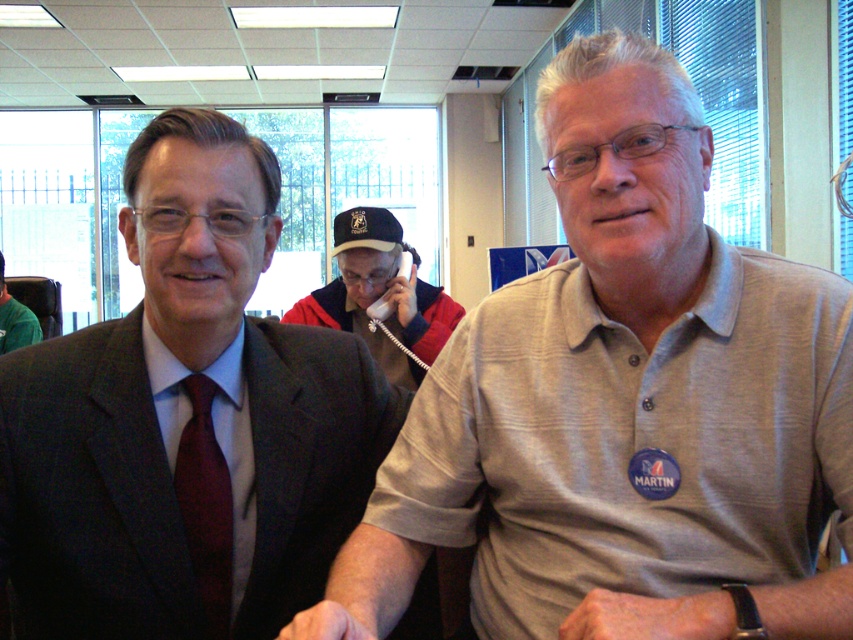
Question: In this image, where is gray textured polo shirt at center located relative to red jacket at center?

Choices:
 (A) below
 (B) above

Answer: (A)

Question: Is red jacket at center to the left of matte red tie at left from the viewer's perspective?

Choices:
 (A) yes
 (B) no

Answer: (B)

Question: Among these points, which one is farthest from the camera?

Choices:
 (A) (209, 476)
 (B) (370, 333)

Answer: (B)

Question: Can you confirm if matte red tie at left is thinner than green fabric shirt at left?

Choices:
 (A) no
 (B) yes

Answer: (B)

Question: Estimate the real-world distances between objects in this image. Which object is closer to the green fabric shirt at left?

Choices:
 (A) gray textured polo shirt at center
 (B) red jacket at center

Answer: (B)

Question: Among these points, which one is nearest to the camera?

Choices:
 (A) (450, 323)
 (B) (1, 305)

Answer: (A)